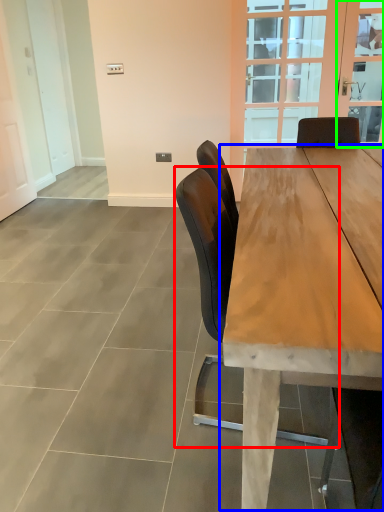
Question: Estimate the real-world distances between objects in this image. Which object is closer to chair (highlighted by a red box), table (highlighted by a blue box) or window screen (highlighted by a green box)?

Choices:
 (A) table
 (B) window screen

Answer: (A)